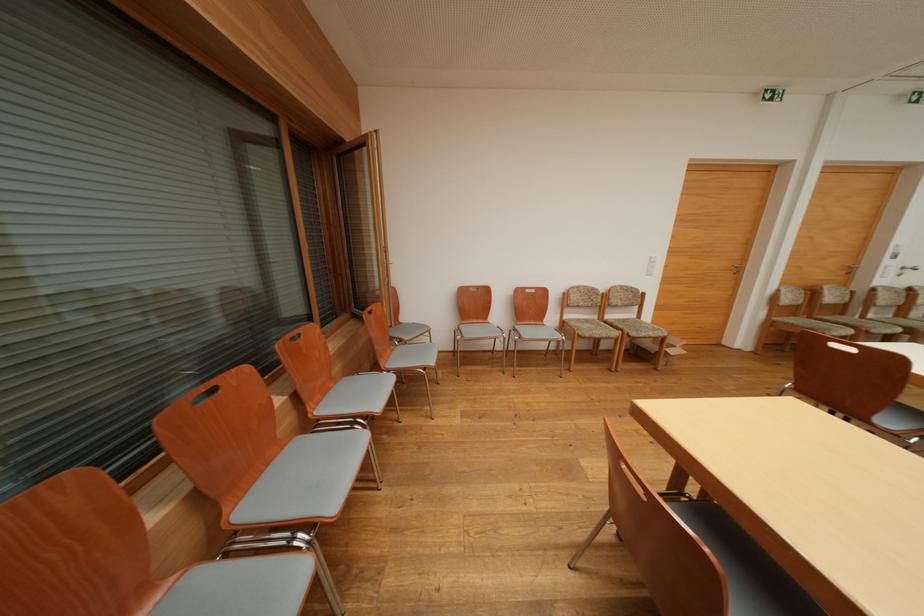
Identify the location of small cardboard box. (657, 349).